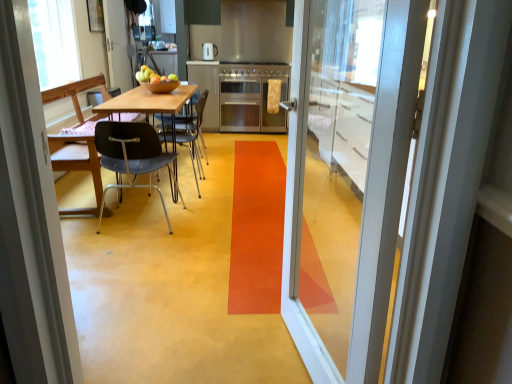
You are a GUI agent. You are given a task and a screenshot of the screen. Output one action in this format:
    pyautogui.click(x=<x>, y=<y>)
    Task: Click on the vacant space in between black plastic chair at left, which is the third chair in left-to-right order, and wooden table at center
    The image size is (512, 384).
    Given the screenshot: What is the action you would take?
    pyautogui.click(x=201, y=174)